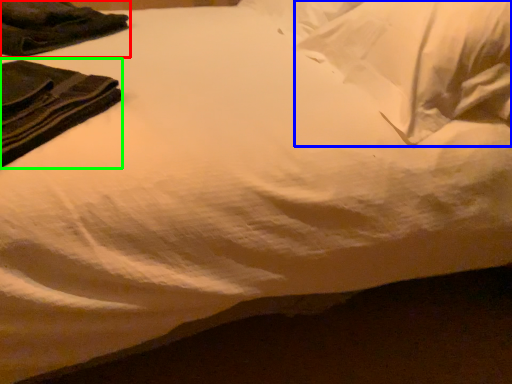
Question: Estimate the real-world distances between objects in this image. Which object is farther from clothing (highlighted by a red box), pillow (highlighted by a blue box) or clothing (highlighted by a green box)?

Choices:
 (A) pillow
 (B) clothing

Answer: (A)